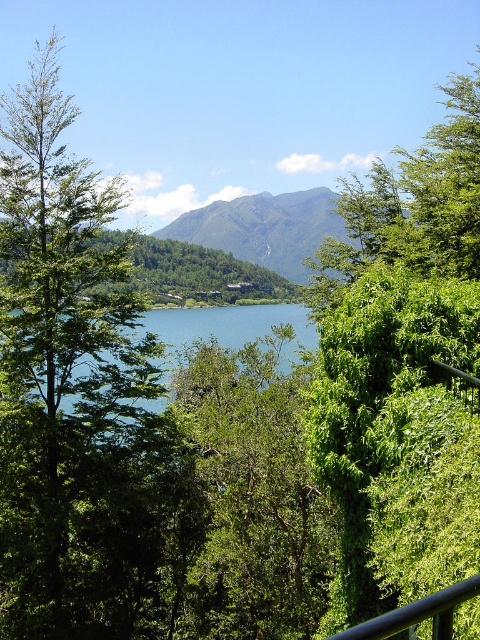
Does green leafy tree at center lie behind blue liquid water at center?

No, green leafy tree at center is in front of blue liquid water at center.

Can you confirm if green leafy tree at center is wider than blue liquid water at center?

Incorrect, green leafy tree at center's width does not surpass blue liquid water at center's.

Which is behind, point (299, 474) or point (184, 324)?

The point (184, 324) is more distant.

Identify the location of green leafy tree at center. This screenshot has width=480, height=640. pyautogui.click(x=248, y=497).

Does green leafy tree at left appear under blue liquid water at center?

Actually, green leafy tree at left is above blue liquid water at center.

Does green leafy tree at left appear on the right side of blue liquid water at center?

No, green leafy tree at left is not to the right of blue liquid water at center.

You are a GUI agent. You are given a task and a screenshot of the screen. Output one action in this format:
    pyautogui.click(x=<x>, y=<y>)
    Task: Click on the green leafy tree at left
    
    Given the screenshot: What is the action you would take?
    pyautogui.click(x=70, y=385)

Is green leafy tree at right positioned behind blue liquid water at center?

No.

Is point (463, 196) less distant than point (282, 358)?

Yes, it is.

At what (x,y) coordinates should I click in order to perform the action: click on green leafy tree at right. Please return your answer as a coordinate pair (x, y). Looking at the image, I should click on (396, 348).